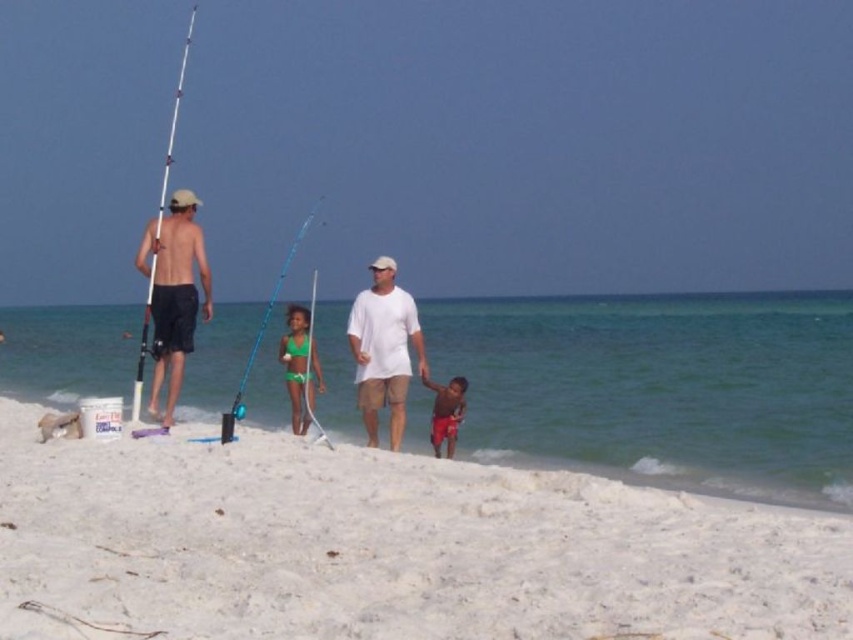
You are standing on the white sandy beach at lower center and want to place the telescopic fiberglass fishing pole at left horizontally on the beach. Based on their sizes, will the fishing pole fit entirely on the beach without extending beyond its edges?

The white sandy beach at lower center is narrower than the telescopic fiberglass fishing pole at left, so placing it horizontally would cause the pole to extend beyond the beach edges.

You are standing on the white sandy beach at lower center and looking towards the shiny black shorts at left. Which object is closer to the horizon?

The white sandy beach at lower center has a lesser height compared to the shiny black shorts at left, so the shiny black shorts at left is closer to the horizon.

You are standing on the beach and see the coordinates point at (x=173, y=292). What object is located at that point?

The point at (x=173, y=292) indicates shiny black shorts at left.